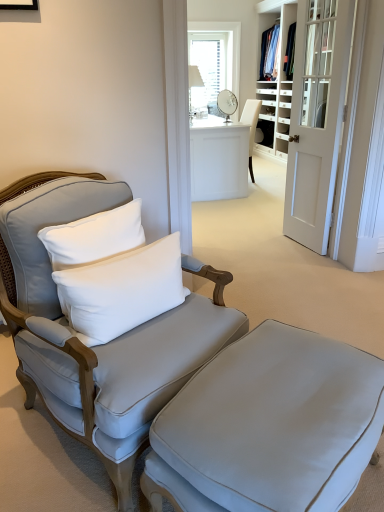
Question: Do you think white glass window at upper center is within satin gray armchair at left, or outside of it?

Choices:
 (A) inside
 (B) outside

Answer: (B)

Question: Does point (235, 92) appear closer or farther from the camera than point (4, 273)?

Choices:
 (A) farther
 (B) closer

Answer: (A)

Question: Which object is positioned farthest from the white glass window at upper center?

Choices:
 (A) matte gray ottoman at lower center
 (B) satin gray armchair at left
 (C) white soft cushion at left
 (D) white wood door at right
 (E) white glossy desk at center

Answer: (A)

Question: Considering the real-world distances, which object is closest to the satin gray armchair at left?

Choices:
 (A) white wood bookshelf at center
 (B) matte gray ottoman at lower center
 (C) white soft cushion at left
 (D) white glossy desk at center
 (E) white glass window at upper center

Answer: (C)